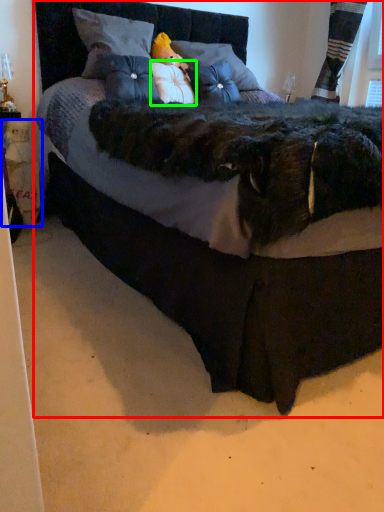
Question: Considering the real-world distances, which object is closest to bed (highlighted by a red box)? doll (highlighted by a blue box) or pillow (highlighted by a green box).

Choices:
 (A) doll
 (B) pillow

Answer: (A)